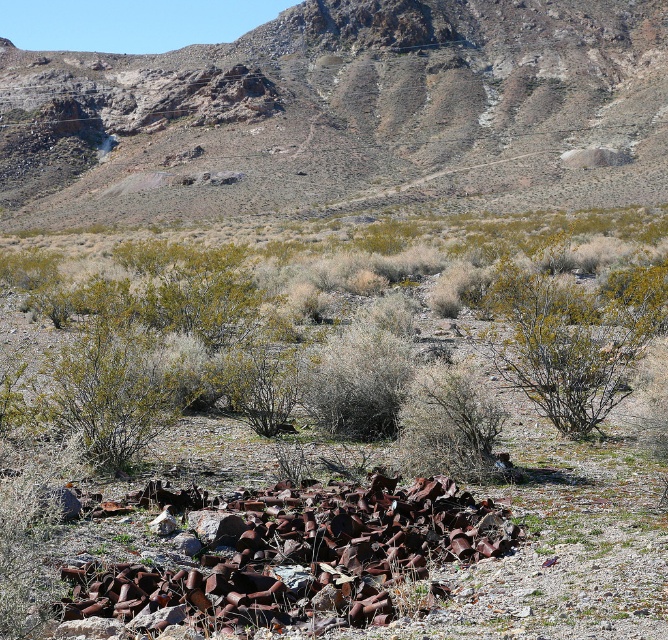
Question: Which of the following is the closest to the observer?

Choices:
 (A) (613, 280)
 (B) (25, 205)

Answer: (A)

Question: Can you confirm if rusty metal mountain at upper center is wider than green shrubs at center?

Choices:
 (A) no
 (B) yes

Answer: (B)

Question: Which of the following is the closest to the observer?

Choices:
 (A) (287, 33)
 (B) (635, 225)

Answer: (B)

Question: Can you confirm if rusty metal mountain at upper center is bigger than green shrubs at center?

Choices:
 (A) no
 (B) yes

Answer: (B)

Question: Is rusty metal mountain at upper center positioned before green shrubs at center?

Choices:
 (A) no
 (B) yes

Answer: (A)

Question: Among these points, which one is farthest from the camera?

Choices:
 (A) (391, 13)
 (B) (31, 256)

Answer: (A)